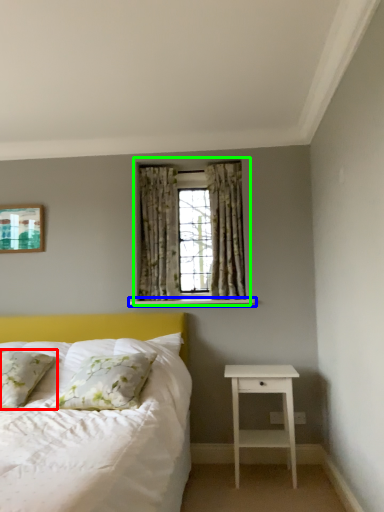
Question: Considering the real-world distances, which object is closest to pillow (highlighted by a red box)? window sill (highlighted by a blue box) or window (highlighted by a green box).

Choices:
 (A) window sill
 (B) window

Answer: (A)